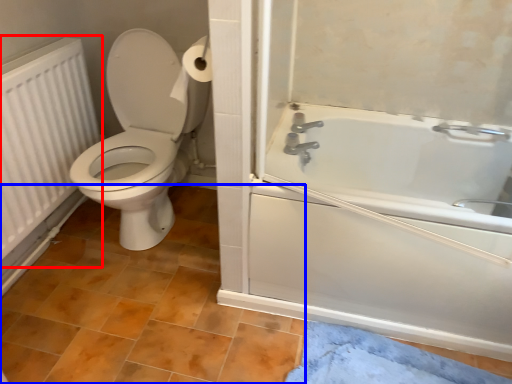
Question: Which of the following is the closest to the observer, radiator (highlighted by a red box) or tile (highlighted by a blue box)?

Choices:
 (A) radiator
 (B) tile

Answer: (B)